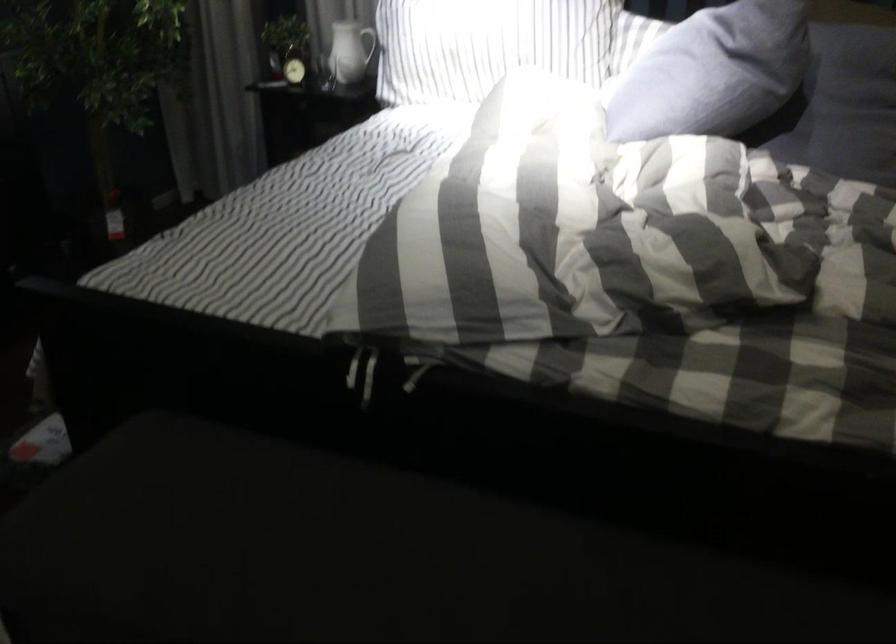
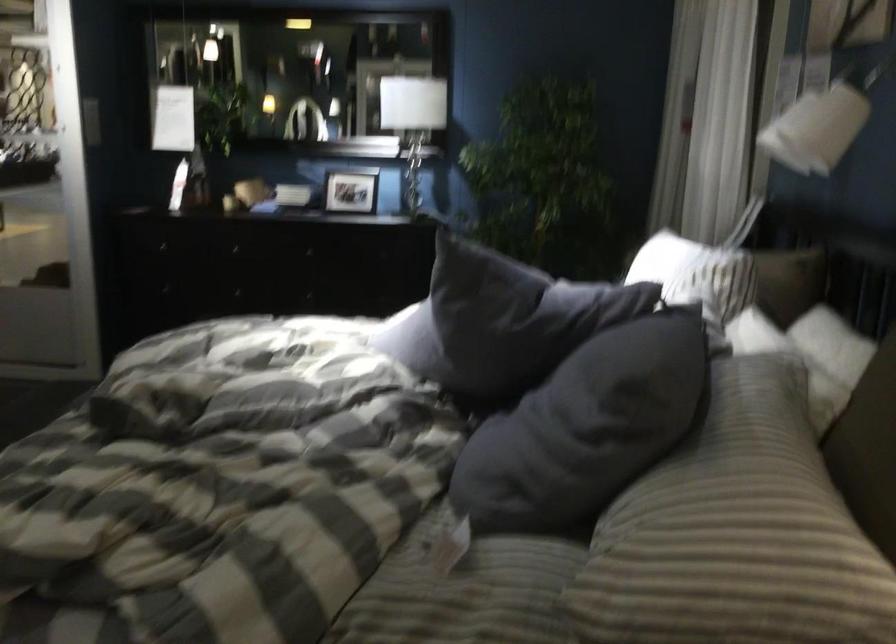
Question: I am providing you with two images of the same scene from different viewpoints. Which of the following objects are not visible in image2?

Choices:
 (A) small picture frame
 (B) red cup
 (C) small alarm clock
 (D) striped pillow

Answer: (C)